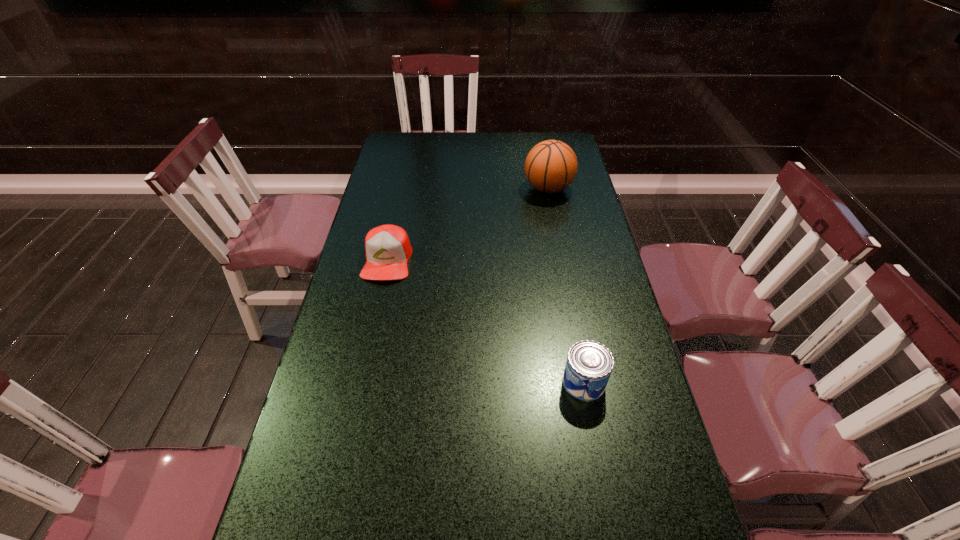
Find the location of a particular element. This screenshot has width=960, height=540. empty space between the basketball and the can is located at coordinates (566, 285).

You are a GUI agent. You are given a task and a screenshot of the screen. Output one action in this format:
    pyautogui.click(x=<x>, y=<y>)
    Task: Click on the vacant area between the basketball and the can
    The image size is (960, 540).
    Given the screenshot: What is the action you would take?
    pyautogui.click(x=566, y=285)

I want to click on free spot between the can and the basketball, so click(566, 285).

Choose which object is the second nearest neighbor to the nearest object. Please provide its 2D coordinates. Your answer should be formatted as a tuple, i.e. [(x, y)], where the tuple contains the x and y coordinates of a point satisfying the conditions above.

[(551, 166)]

Select which object appears as the second closest to the can. Please provide its 2D coordinates. Your answer should be formatted as a tuple, i.e. [(x, y)], where the tuple contains the x and y coordinates of a point satisfying the conditions above.

[(551, 166)]